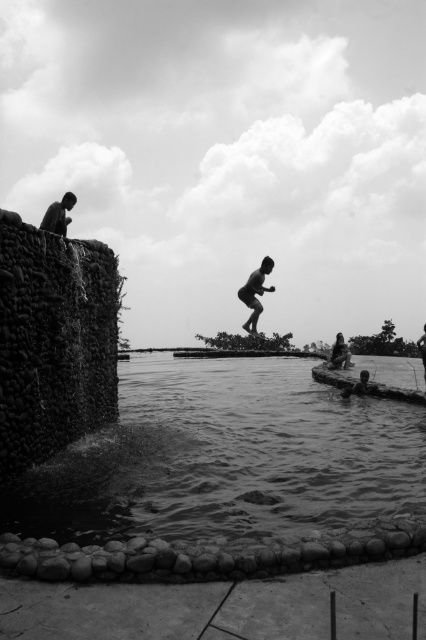
Can you confirm if smooth water at lower center is shorter than dark skin human at upper left?

Indeed, smooth water at lower center has a lesser height compared to dark skin human at upper left.

Is smooth water at lower center to the left of dark skin human at upper left from the viewer's perspective?

In fact, smooth water at lower center is to the right of dark skin human at upper left.

Which is in front, point (31, 484) or point (43, 216)?

Point (31, 484)

Find the location of a particular element. This screenshot has height=640, width=426. smooth water at lower center is located at coordinates (224, 456).

Who is taller, smooth water at lower center or smooth skin man at center?

smooth skin man at center is taller.

Can you confirm if smooth water at lower center is shorter than smooth skin man at center?

Yes.

From the picture: Who is more distant from viewer, (x=187, y=520) or (x=425, y=387)?

Point (x=425, y=387)

The width and height of the screenshot is (426, 640). I want to click on smooth water at lower center, so click(224, 456).

Consider the image. Can you confirm if silhouette wooden skateboard at center is positioned below dark skin human at upper left?

A: Indeed, silhouette wooden skateboard at center is positioned under dark skin human at upper left.

Is silhouette wooden skateboard at center to the right of dark skin human at upper left from the viewer's perspective?

Yes, silhouette wooden skateboard at center is to the right of dark skin human at upper left.

Locate an element on the screen. silhouette wooden skateboard at center is located at coordinates (255, 292).

Where is `silhouette wooden skateboard at center`? silhouette wooden skateboard at center is located at coordinates (255, 292).